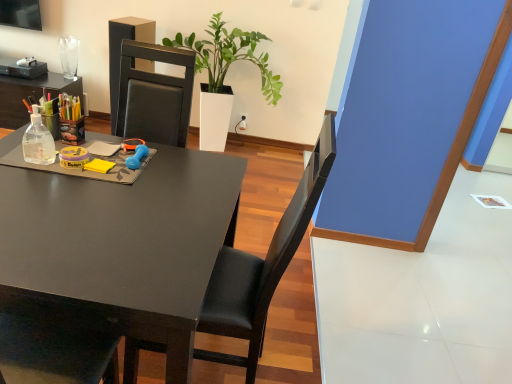
Question: Is matte black desk at center at the back of black leather chair at center?

Choices:
 (A) no
 (B) yes

Answer: (B)

Question: Is black leather chair at center further to camera compared to matte black desk at center?

Choices:
 (A) no
 (B) yes

Answer: (B)

Question: From a real-world perspective, is black leather chair at center over matte black desk at center?

Choices:
 (A) no
 (B) yes

Answer: (B)

Question: From a real-world perspective, is black leather chair at center below matte black desk at center?

Choices:
 (A) yes
 (B) no

Answer: (B)

Question: Does black leather chair at center have a smaller size compared to matte black desk at center?

Choices:
 (A) no
 (B) yes

Answer: (B)

Question: Can you confirm if black leather chair at center is shorter than matte black desk at center?

Choices:
 (A) yes
 (B) no

Answer: (B)

Question: Can we say black leather chair at center lies outside white glossy planter at center?

Choices:
 (A) no
 (B) yes

Answer: (B)

Question: Considering the relative sizes of black leather chair at center and white glossy planter at center in the image provided, is black leather chair at center smaller than white glossy planter at center?

Choices:
 (A) yes
 (B) no

Answer: (A)

Question: Considering the relative positions of black leather chair at center and white glossy planter at center in the image provided, is black leather chair at center behind white glossy planter at center?

Choices:
 (A) no
 (B) yes

Answer: (A)

Question: Does black leather chair at center appear on the right side of white glossy planter at center?

Choices:
 (A) yes
 (B) no

Answer: (A)

Question: Is white glossy planter at center completely or partially inside black leather chair at center?

Choices:
 (A) yes
 (B) no

Answer: (B)

Question: From a real-world perspective, is black leather chair at center beneath white glossy planter at center?

Choices:
 (A) yes
 (B) no

Answer: (B)

Question: From the image's perspective, is white glossy planter at center under matte black desk at center?

Choices:
 (A) yes
 (B) no

Answer: (B)